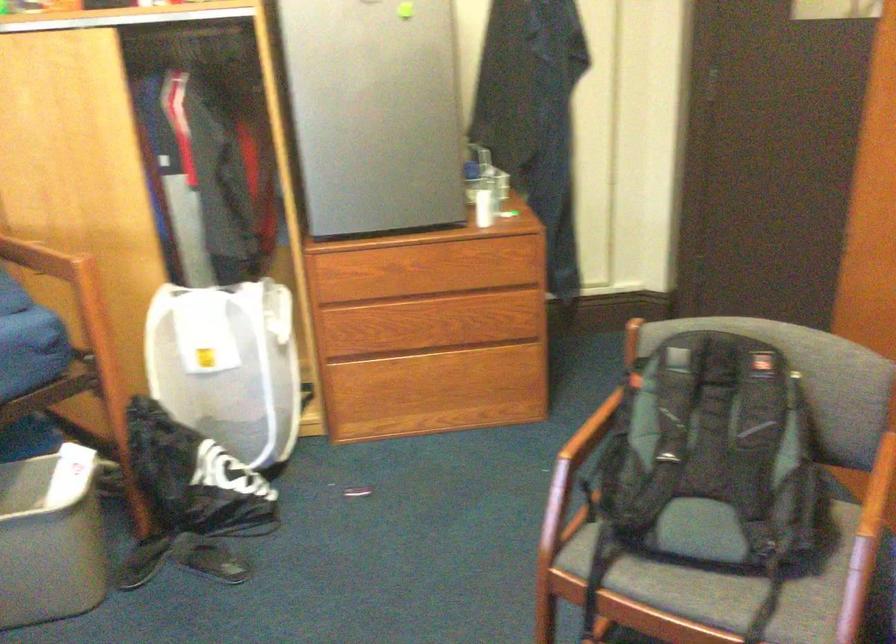
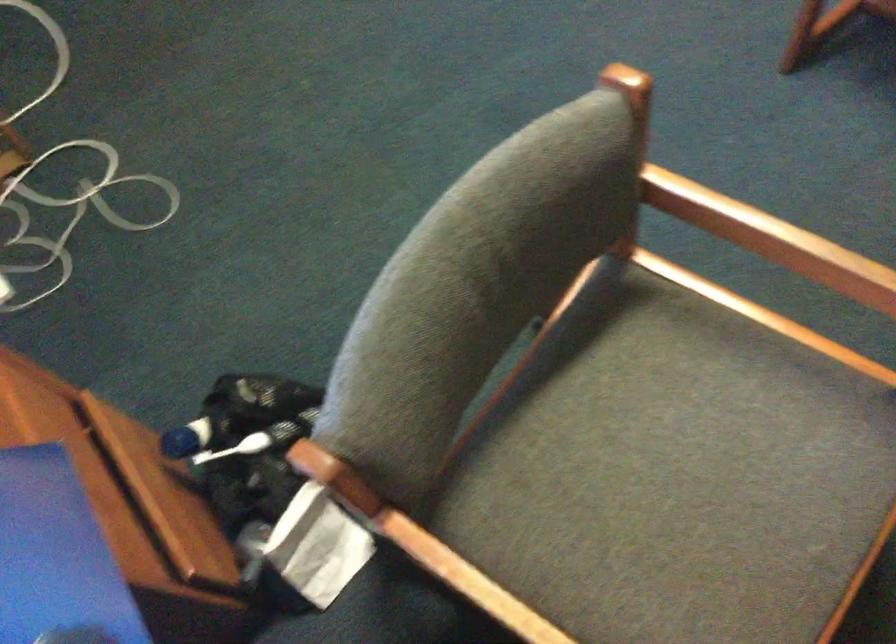
The images are taken continuously from a first-person perspective. In which direction is your viewpoint rotating?

The camera's rotation is toward left-down.